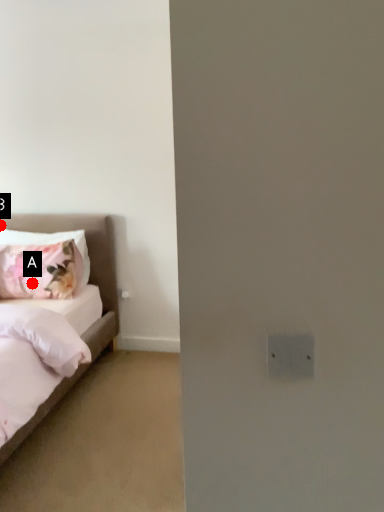
Question: Two points are circled on the image, labeled by A and B beside each circle. Which of the following is the closest to the observer?

Choices:
 (A) A is closer
 (B) B is closer

Answer: (A)